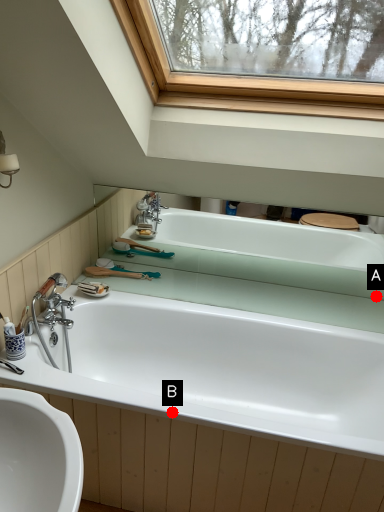
Question: Two points are circled on the image, labeled by A and B beside each circle. Among these points, which one is nearest to the camera?

Choices:
 (A) A is closer
 (B) B is closer

Answer: (B)